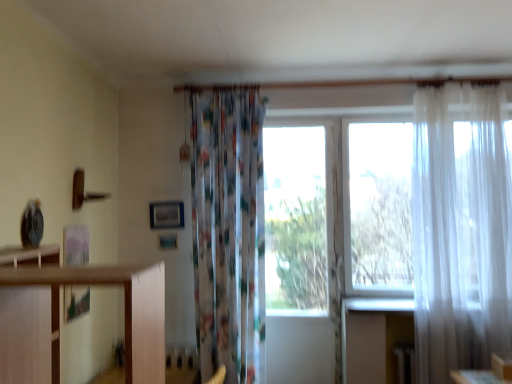
Question: In terms of height, does translucent white curtain at right, the 1th curtain when ordered from right to left, look taller or shorter compared to printed fabric curtain at center, arranged as the 1th curtain when viewed from the left?

Choices:
 (A) short
 (B) tall

Answer: (A)

Question: Based on their sizes in the image, would you say translucent white curtain at right, the 1th curtain when ordered from right to left, is bigger or smaller than printed fabric curtain at center, the second curtain positioned from the right?

Choices:
 (A) big
 (B) small

Answer: (A)

Question: Estimate the real-world distances between objects in this image. Which object is farther from the transparent white curtain at right?

Choices:
 (A) translucent white curtain at right, which is the 2th curtain from left to right
 (B) wooden shelf at left
 (C) printed fabric curtain at center, arranged as the 1th curtain when viewed from the left
 (D) transparent glass window at center

Answer: (B)

Question: Considering the real-world distances, which object is farthest from the translucent white curtain at right, which is the 2th curtain from left to right?

Choices:
 (A) transparent glass window at center
 (B) wooden shelf at left
 (C) printed fabric curtain at center, arranged as the 1th curtain when viewed from the left
 (D) transparent white curtain at right

Answer: (B)